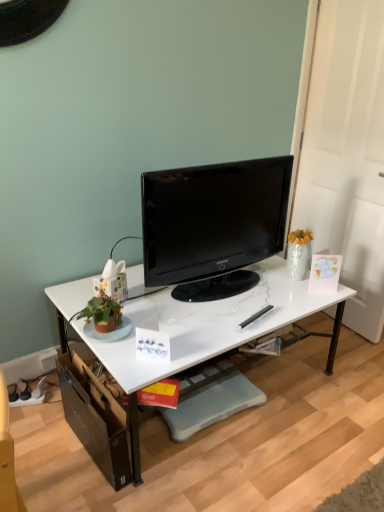
Identify the location of free point below black glossy tv at center (from a real-world perspective). The width and height of the screenshot is (384, 512). (202, 292).